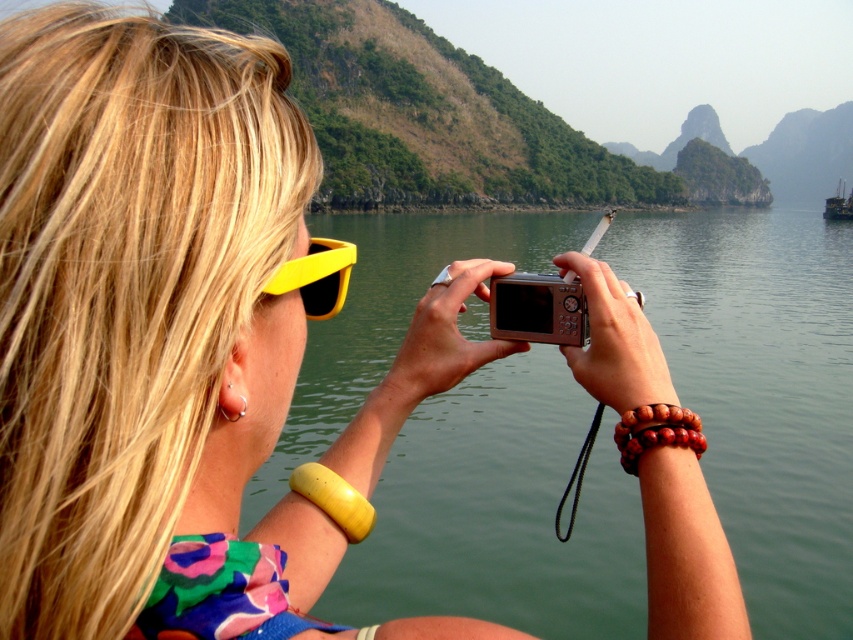
Is green water at center thinner than silver metallic camera at center?

No, green water at center is not thinner than silver metallic camera at center.

Is green water at center positioned before silver metallic camera at center?

That is True.

This screenshot has width=853, height=640. Find the location of `green water at center`. green water at center is located at coordinates (761, 390).

Can you confirm if green water at center is smaller than metallic gray boat at right?

No.

Can you confirm if green water at center is thinner than metallic gray boat at right?

In fact, green water at center might be wider than metallic gray boat at right.

Describe the element at coordinates (761, 390) in the screenshot. I see `green water at center` at that location.

You are a GUI agent. You are given a task and a screenshot of the screen. Output one action in this format:
    pyautogui.click(x=<x>, y=<y>)
    Task: Click on the green water at center
    The image size is (853, 640).
    Given the screenshot: What is the action you would take?
    pyautogui.click(x=761, y=390)

Between point (300, 275) and point (831, 212), which one is positioned behind?

The point (831, 212) is behind.

Which is more to the right, yellow matte sunglasses at upper left or metallic gray boat at right?

Positioned to the right is metallic gray boat at right.

Where is `yellow matte sunglasses at upper left`? yellow matte sunglasses at upper left is located at coordinates (316, 276).

The height and width of the screenshot is (640, 853). What are the coordinates of `yellow matte sunglasses at upper left` in the screenshot? It's located at (316, 276).